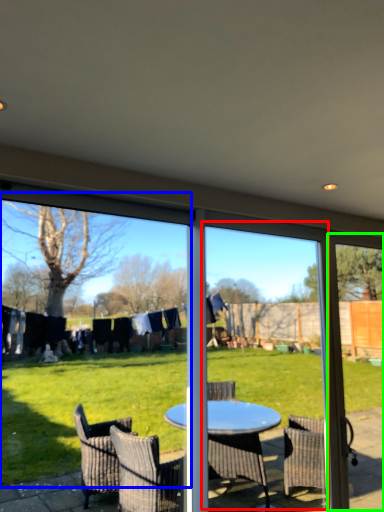
Question: Estimate the real-world distances between objects in this image. Which object is farther from screen door (highlighted by a red box), window screen (highlighted by a blue box) or screen door (highlighted by a green box)?

Choices:
 (A) window screen
 (B) screen door

Answer: (B)